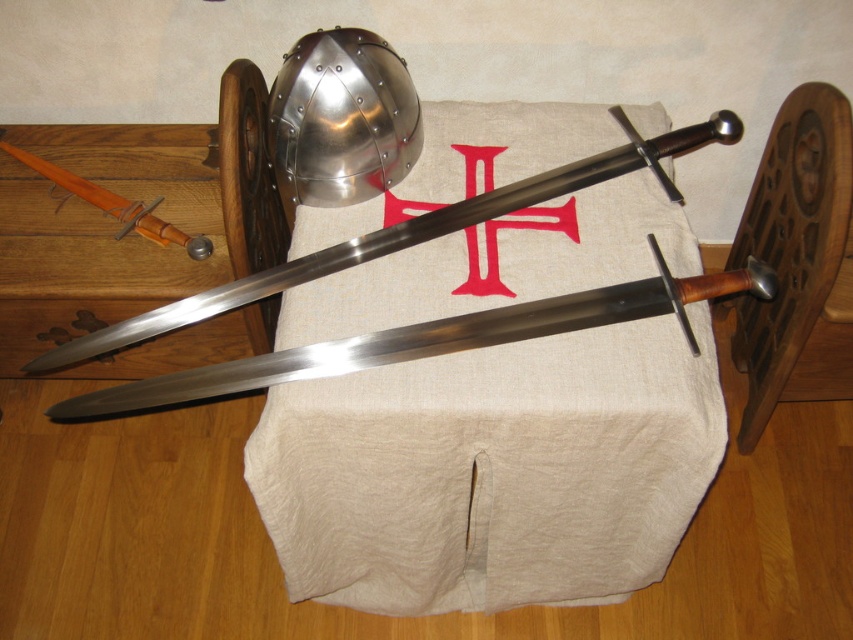
From the picture: Can you confirm if polished metal sword at center is positioned to the right of shiny metallic helmet at upper center?

Yes, polished metal sword at center is to the right of shiny metallic helmet at upper center.

Can you confirm if polished metal sword at center is shorter than shiny metallic helmet at upper center?

No, polished metal sword at center is not shorter than shiny metallic helmet at upper center.

Consider the image. Who is more distant from viewer, (x=669, y=276) or (x=379, y=115)?

The point (x=379, y=115) is more distant.

Where is `polished metal sword at center`? The height and width of the screenshot is (640, 853). polished metal sword at center is located at coordinates (433, 339).

Can you confirm if shiny metallic helmet at upper center is thinner than polished wood sword at upper left?

Yes.

Which is above, shiny metallic helmet at upper center or polished wood sword at upper left?

shiny metallic helmet at upper center is higher up.

What do you see at coordinates (341, 118) in the screenshot? The height and width of the screenshot is (640, 853). I see `shiny metallic helmet at upper center` at bounding box center [341, 118].

The height and width of the screenshot is (640, 853). I want to click on shiny metallic helmet at upper center, so click(341, 118).

Between beige linen tablecloth at center and polished wood sword at upper left, which one has less height?

polished wood sword at upper left is shorter.

Is beige linen tablecloth at center positioned in front of polished wood sword at upper left?

Yes.

Locate an element on the screen. This screenshot has height=640, width=853. beige linen tablecloth at center is located at coordinates (492, 472).

Identify the location of beige linen tablecloth at center. The image size is (853, 640). (492, 472).